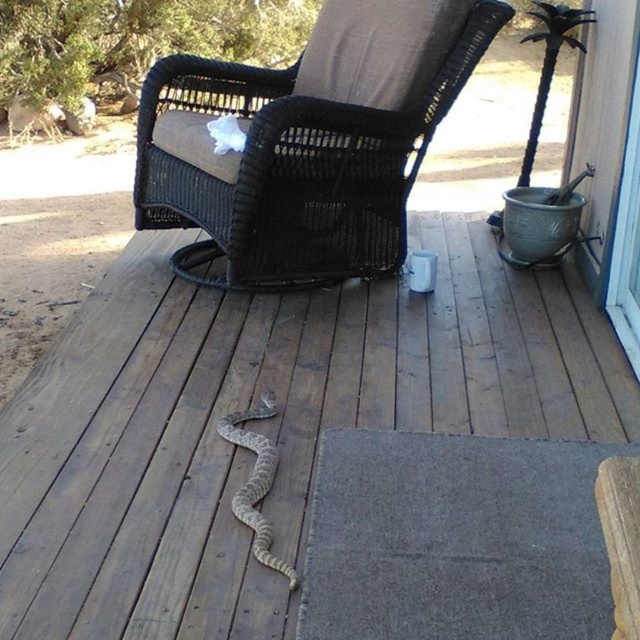
Question: Observing the image, what is the correct spatial positioning of brown textured snake at center in reference to brown scaly snake at center?

Choices:
 (A) right
 (B) left

Answer: (A)

Question: Among these points, which one is nearest to the camera?

Choices:
 (A) (253, 525)
 (B) (180, 273)
 (C) (163, 545)
 (D) (630, 360)

Answer: (C)

Question: Which point is closer to the camera?

Choices:
 (A) (196, 477)
 (B) (624, 296)
 (C) (448, 36)

Answer: (A)

Question: Is brown textured snake at center closer to camera compared to transparent glass screen door at upper right?

Choices:
 (A) yes
 (B) no

Answer: (A)

Question: Which of the following is the farthest from the observer?

Choices:
 (A) transparent glass screen door at upper right
 (B) brown scaly snake at center
 (C) transparent glass screen door at right
 (D) black wicker chair at center

Answer: (C)

Question: Does black wicker chair at center appear under transparent glass screen door at upper right?

Choices:
 (A) no
 (B) yes

Answer: (A)